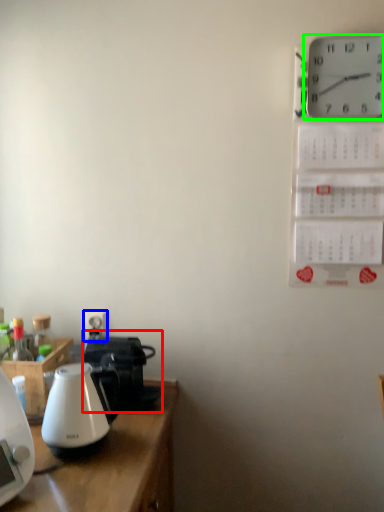
Question: Which object is the closest to the coffeepot (highlighted by a red box)? Choose among these: electric outlet (highlighted by a blue box) or wall clock (highlighted by a green box).

Choices:
 (A) electric outlet
 (B) wall clock

Answer: (A)